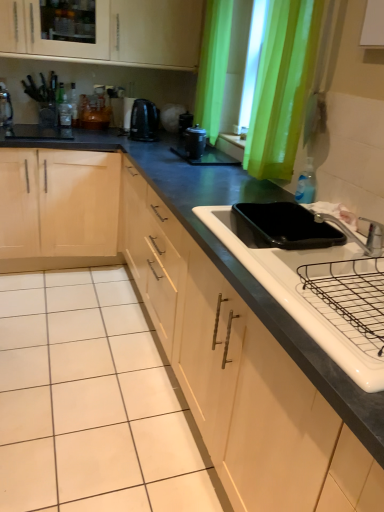
Where is `free location to the right of black glossy electric kettle at center`? free location to the right of black glossy electric kettle at center is located at coordinates (172, 138).